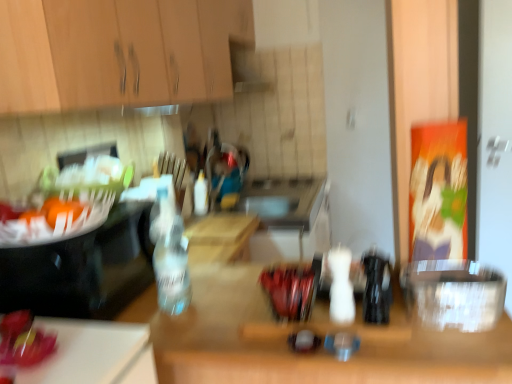
Question: Is black plastic bottle at center, the 3th bottle when ordered from left to right, to the right of transparent plastic container at right, which is the first appliance from right to left, from the viewer's perspective?

Choices:
 (A) yes
 (B) no

Answer: (B)

Question: From the image's perspective, is black plastic bottle at center, the 1th bottle when ordered from front to back, under transparent plastic container at right, the second appliance positioned from the left?

Choices:
 (A) yes
 (B) no

Answer: (B)

Question: From a real-world perspective, is black plastic bottle at center, the 3th bottle when ordered from left to right, located higher than transparent plastic container at right, the second appliance positioned from the left?

Choices:
 (A) yes
 (B) no

Answer: (A)

Question: From the image's perspective, is black plastic bottle at center, which appears as the third bottle when viewed from the back, over transparent plastic container at right, which is the first appliance from right to left?

Choices:
 (A) no
 (B) yes

Answer: (B)

Question: Considering the relative sizes of black plastic bottle at center, the 1th bottle when ordered from front to back, and transparent plastic container at right, which is the first appliance from right to left, in the image provided, is black plastic bottle at center, the 1th bottle when ordered from front to back, wider than transparent plastic container at right, which is the first appliance from right to left,?

Choices:
 (A) no
 (B) yes

Answer: (A)

Question: Is transparent plastic container at right, the second appliance positioned from the left, taller or shorter than wooden cabinet at upper left?

Choices:
 (A) short
 (B) tall

Answer: (A)

Question: Is transparent plastic container at right, the second appliance positioned from the left, wider or thinner than wooden cabinet at upper left?

Choices:
 (A) wide
 (B) thin

Answer: (B)

Question: Is transparent plastic container at right, the second appliance positioned from the left, bigger or smaller than wooden cabinet at upper left?

Choices:
 (A) big
 (B) small

Answer: (B)

Question: From the image's perspective, is transparent plastic container at right, which is the first appliance from right to left, above or below wooden cabinet at upper left?

Choices:
 (A) below
 (B) above

Answer: (A)

Question: Which is correct: shiny red apple at lower left is inside wooden table at center, or outside of it?

Choices:
 (A) outside
 (B) inside

Answer: (A)

Question: In terms of width, does shiny red apple at lower left look wider or thinner when compared to wooden table at center?

Choices:
 (A) thin
 (B) wide

Answer: (A)

Question: From the image's perspective, is shiny red apple at lower left positioned above or below wooden table at center?

Choices:
 (A) below
 (B) above

Answer: (B)

Question: Is shiny red apple at lower left to the left or to the right of wooden table at center in the image?

Choices:
 (A) right
 (B) left

Answer: (B)

Question: In terms of size, does black plastic bottle at center, which appears as the third bottle when viewed from the back, appear bigger or smaller than white plastic bottle at center, the 3th bottle from the front?

Choices:
 (A) small
 (B) big

Answer: (A)

Question: In the image, is black plastic bottle at center, which ranks as the first bottle in right-to-left order, positioned in front of or behind white plastic bottle at center, arranged as the third bottle when viewed from the right?

Choices:
 (A) front
 (B) behind

Answer: (A)